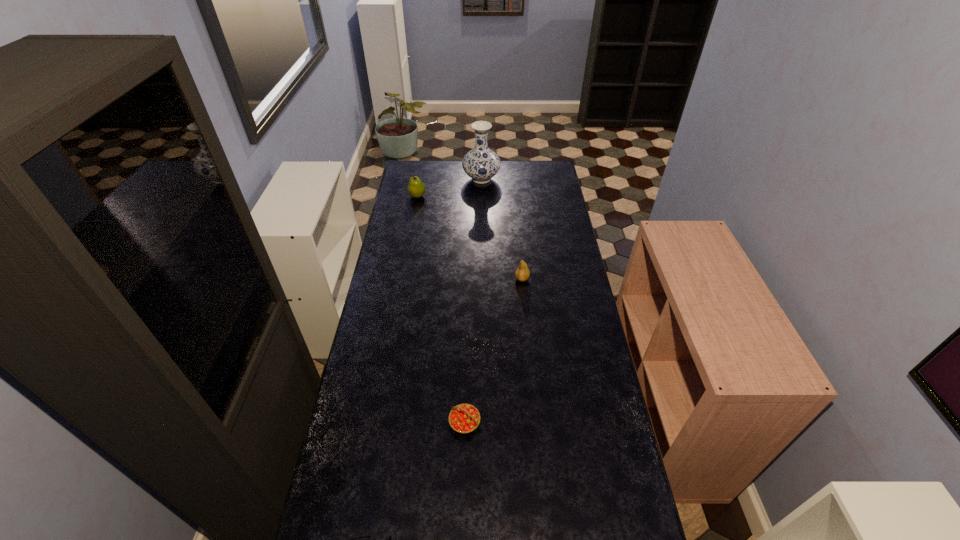
The image size is (960, 540). I want to click on vase, so click(x=481, y=164).

Locate an element on the screen. the tallest object is located at coordinates (481, 164).

Find the location of a particular element. Image resolution: width=960 pixels, height=540 pixels. the left pear is located at coordinates (416, 188).

This screenshot has width=960, height=540. What are the coordinates of `the farther pear` in the screenshot? It's located at (416, 188).

Image resolution: width=960 pixels, height=540 pixels. I want to click on the nearer pear, so click(522, 273).

I want to click on the right pear, so pos(522,273).

Locate an element on the screen. the fourth tallest object is located at coordinates (464, 418).

The width and height of the screenshot is (960, 540). I want to click on the fourth farthest object, so click(464, 418).

This screenshot has width=960, height=540. Find the location of `vacant region located on the right of the farthest object`. vacant region located on the right of the farthest object is located at coordinates (516, 179).

I want to click on free space located on the right of the left pear, so [x=484, y=196].